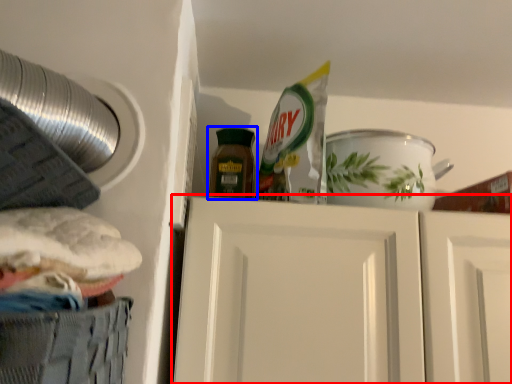
Question: Which of the following is the farthest to the observer, door (highlighted by a red box) or bottle (highlighted by a blue box)?

Choices:
 (A) door
 (B) bottle

Answer: (B)